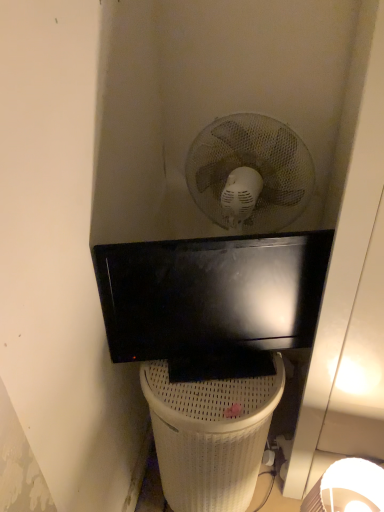
What is the approximate width of white woven trash bin/can at lower center?

It is 13.70 inches.

What do you see at coordinates (210, 436) in the screenshot?
I see `white woven trash bin/can at lower center` at bounding box center [210, 436].

Find the location of a particular element. white woven trash bin/can at lower center is located at coordinates (210, 436).

Measure the distance between black glossy television at center and camera.

The distance of black glossy television at center from camera is 37.15 inches.

This screenshot has height=512, width=384. What do you see at coordinates (212, 301) in the screenshot?
I see `black glossy television at center` at bounding box center [212, 301].

In order to click on black glossy television at center in this screenshot , I will do `click(212, 301)`.

Where is `white woven trash bin/can at lower center`? Image resolution: width=384 pixels, height=512 pixels. white woven trash bin/can at lower center is located at coordinates (210, 436).

Between black glossy television at center and white woven trash bin/can at lower center, which one appears on the right side from the viewer's perspective?

black glossy television at center is more to the right.

Which is in front, black glossy television at center or white woven trash bin/can at lower center?

black glossy television at center is in front.

Is point (301, 318) closer to camera compared to point (143, 374)?

Yes, it is in front of point (143, 374).

From the image's perspective, which one is positioned higher, black glossy television at center or white woven trash bin/can at lower center?

From the image's view, black glossy television at center is above.

From a real-world perspective, does black glossy television at center stand above white woven trash bin/can at lower center?

Yes, from a real-world perspective, black glossy television at center is on top of white woven trash bin/can at lower center.

Between black glossy television at center and white woven trash bin/can at lower center, which one has smaller width?

black glossy television at center.

Who is taller, black glossy television at center or white woven trash bin/can at lower center?

Standing taller between the two is white woven trash bin/can at lower center.

Is black glossy television at center bigger than white woven trash bin/can at lower center?

Actually, black glossy television at center might be smaller than white woven trash bin/can at lower center.

Could white woven trash bin/can at lower center be considered to be inside black glossy television at center?

No, white woven trash bin/can at lower center is not inside black glossy television at center.

Is black glossy television at center touching white woven trash bin/can at lower center?

No, black glossy television at center is not in contact with white woven trash bin/can at lower center.

Is white woven trash bin/can at lower center at the back of black glossy television at center?

No, black glossy television at center's orientation is not away from white woven trash bin/can at lower center.

How different are the orientations of black glossy television at center and white woven trash bin/can at lower center in degrees?

18.6 degrees.

Based on the photo, measure the distance between black glossy television at center and white woven trash bin/can at lower center.

black glossy television at center is 8.64 inches from white woven trash bin/can at lower center.

Find the location of a particular element. The image size is (384, 512). trash bin/can below the black glossy television at center (from the image's perspective) is located at coordinates (210, 436).

Considering the relative positions of white woven trash bin/can at lower center and black glossy television at center in the image provided, is white woven trash bin/can at lower center to the left of black glossy television at center from the viewer's perspective?

Yes, white woven trash bin/can at lower center is to the left of black glossy television at center.

Which object is further away from the camera taking this photo, white woven trash bin/can at lower center or black glossy television at center?

white woven trash bin/can at lower center is behind.

Which is in front, point (185, 404) or point (137, 335)?

Point (185, 404)

From the image's perspective, relative to black glossy television at center, is white woven trash bin/can at lower center above or below?

white woven trash bin/can at lower center is situated lower than black glossy television at center in the image.

Looking at this image, from a real-world perspective, is white woven trash bin/can at lower center physically above black glossy television at center?

No.

Considering the relative sizes of white woven trash bin/can at lower center and black glossy television at center in the image provided, is white woven trash bin/can at lower center thinner than black glossy television at center?

Incorrect, the width of white woven trash bin/can at lower center is not less than that of black glossy television at center.

Does white woven trash bin/can at lower center have a lesser height compared to black glossy television at center?

No.

Based on the photo, looking at the image, does white woven trash bin/can at lower center seem bigger or smaller compared to black glossy television at center?

Considering their sizes, white woven trash bin/can at lower center takes up more space than black glossy television at center.

Would you say white woven trash bin/can at lower center is outside black glossy television at center?

Absolutely, white woven trash bin/can at lower center is external to black glossy television at center.

Is white woven trash bin/can at lower center far from black glossy television at center?

No.

Is white woven trash bin/can at lower center positioned with its back to black glossy television at center?

→ No, black glossy television at center is not at the back of white woven trash bin/can at lower center.

What's the angular difference between white woven trash bin/can at lower center and black glossy television at center's facing directions?

18.6 degrees.

The height and width of the screenshot is (512, 384). In order to click on television in front of the white woven trash bin/can at lower center in this screenshot , I will do `click(212, 301)`.

There is a white woven trash bin/can at lower center. Where is `television above it (from a real-world perspective)`? television above it (from a real-world perspective) is located at coordinates (212, 301).

You are a GUI agent. You are given a task and a screenshot of the screen. Output one action in this format:
    pyautogui.click(x=<x>, y=<y>)
    Task: Click on the trash bin/can on the left of the black glossy television at center
    
    Given the screenshot: What is the action you would take?
    pyautogui.click(x=210, y=436)